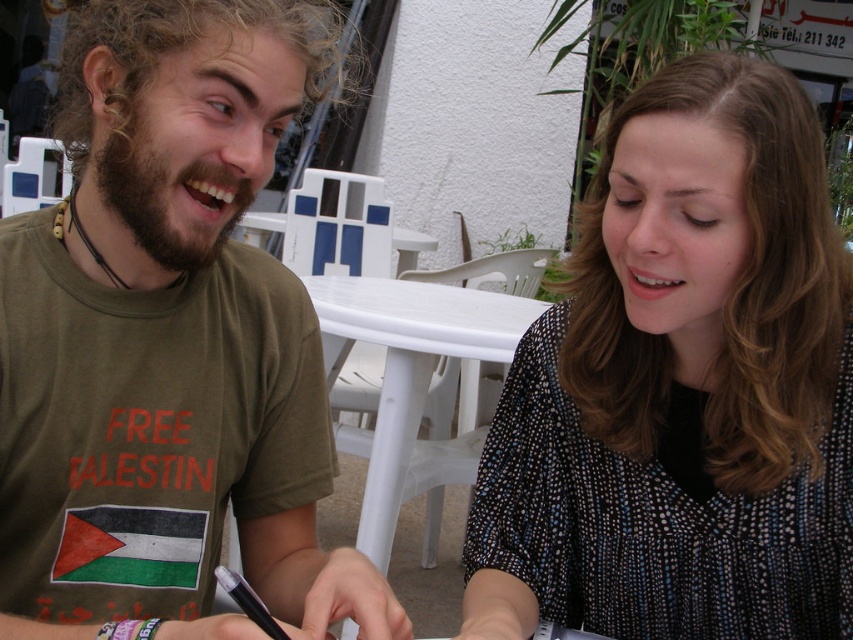
Does green matte t-shirt at center have a lesser height compared to white plastic table at center?

Yes, green matte t-shirt at center is shorter than white plastic table at center.

Which is behind, point (91, 68) or point (357, 280)?

The point (357, 280) is behind.

The width and height of the screenshot is (853, 640). I want to click on green matte t-shirt at center, so click(x=167, y=346).

Can you confirm if green matte t-shirt at center is positioned to the right of black dotted blouse at center?

In fact, green matte t-shirt at center is to the left of black dotted blouse at center.

This screenshot has width=853, height=640. I want to click on green matte t-shirt at center, so click(x=167, y=346).

Where is `green matte t-shirt at center`? green matte t-shirt at center is located at coordinates (167, 346).

The height and width of the screenshot is (640, 853). Identify the location of green matte t-shirt at center. (167, 346).

Which is in front, point (434, 300) or point (219, 584)?

Positioned in front is point (219, 584).

Which is behind, point (370, 314) or point (247, 609)?

The point (370, 314) is behind.

At what (x,y) coordinates should I click in order to perform the action: click on white plastic table at center. Please return your answer as a coordinate pair (x, y). The height and width of the screenshot is (640, 853). Looking at the image, I should click on click(409, 374).

Locate an element on the screen. The width and height of the screenshot is (853, 640). white plastic table at center is located at coordinates (409, 374).